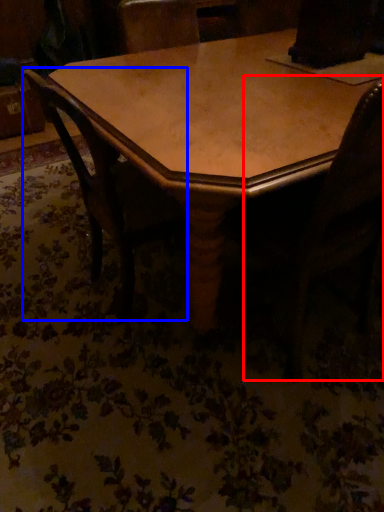
Question: Which point is further to the camera, swivel chair (highlighted by a red box) or chair (highlighted by a blue box)?

Choices:
 (A) swivel chair
 (B) chair

Answer: (B)